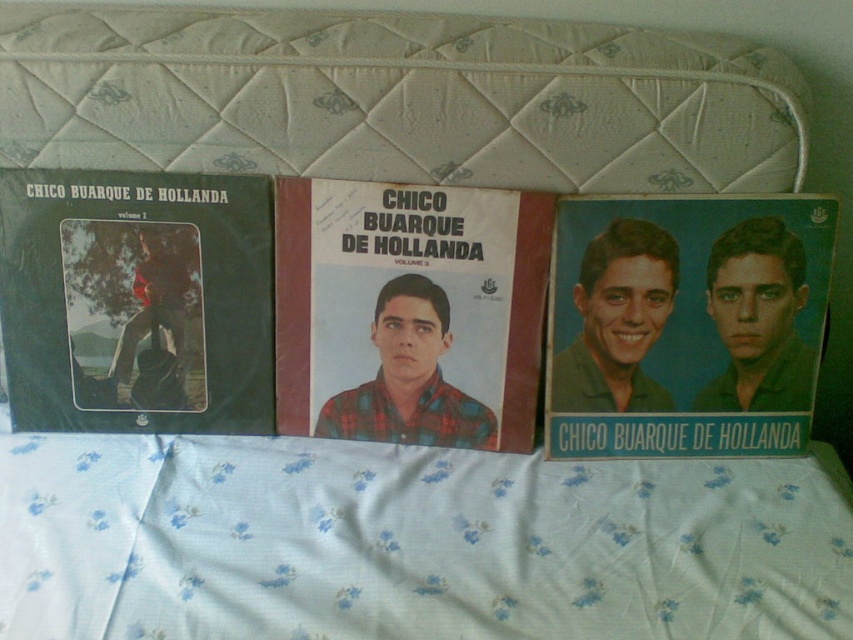
Can you confirm if white fabric at upper center is smaller than green matte vinyl record at left?

No.

Which of these two, white fabric at upper center or green matte vinyl record at left, stands taller?

Standing taller between the two is green matte vinyl record at left.

Does point (752, 573) come closer to viewer compared to point (149, 193)?

Yes, it is in front of point (149, 193).

The image size is (853, 640). In order to click on white fabric at upper center in this screenshot , I will do `click(412, 544)`.

Does white fabric at upper center have a smaller size compared to blue matte poster at center?

Incorrect, white fabric at upper center is not smaller in size than blue matte poster at center.

Is white fabric at upper center taller than blue matte poster at center?

In fact, white fabric at upper center may be shorter than blue matte poster at center.

Where is `white fabric at upper center`? This screenshot has width=853, height=640. white fabric at upper center is located at coordinates (412, 544).

Is green matte vinyl record at left wider than plaid fabric album cover at center?

Indeed, green matte vinyl record at left has a greater width compared to plaid fabric album cover at center.

In the scene shown: Is green matte vinyl record at left taller than plaid fabric album cover at center?

In fact, green matte vinyl record at left may be shorter than plaid fabric album cover at center.

Which is in front, point (67, 394) or point (509, 451)?

Positioned in front is point (67, 394).

Where is `green matte vinyl record at left`? green matte vinyl record at left is located at coordinates (136, 300).